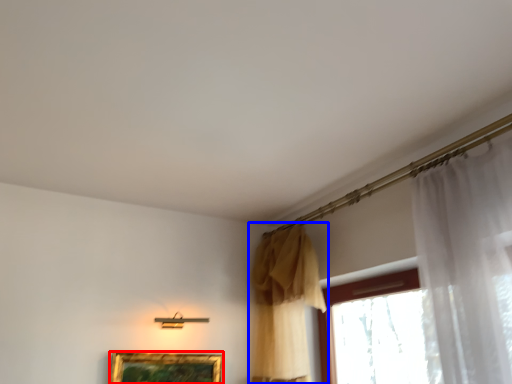
Question: Among these objects, which one is farthest to the camera, picture frame (highlighted by a red box) or curtain (highlighted by a blue box)?

Choices:
 (A) picture frame
 (B) curtain

Answer: (A)